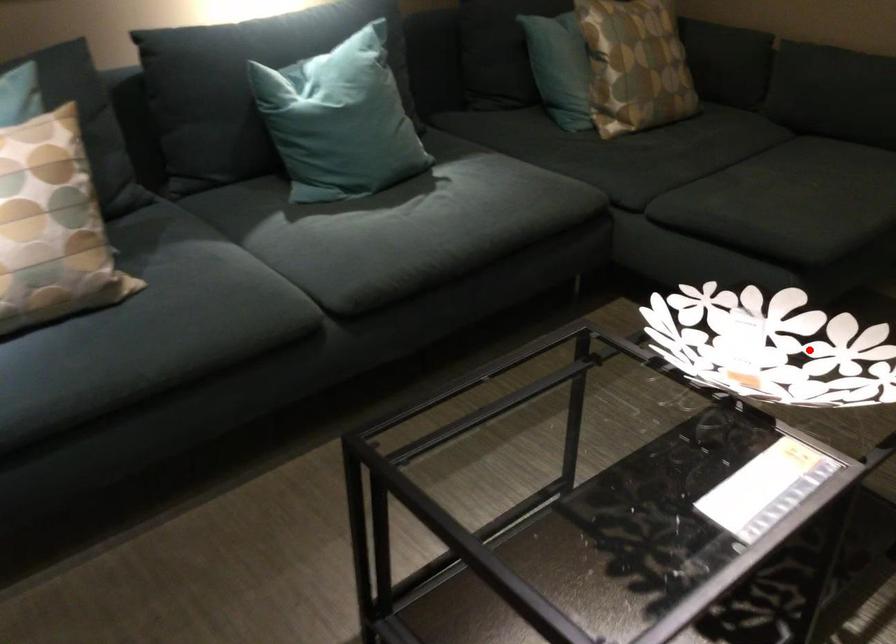
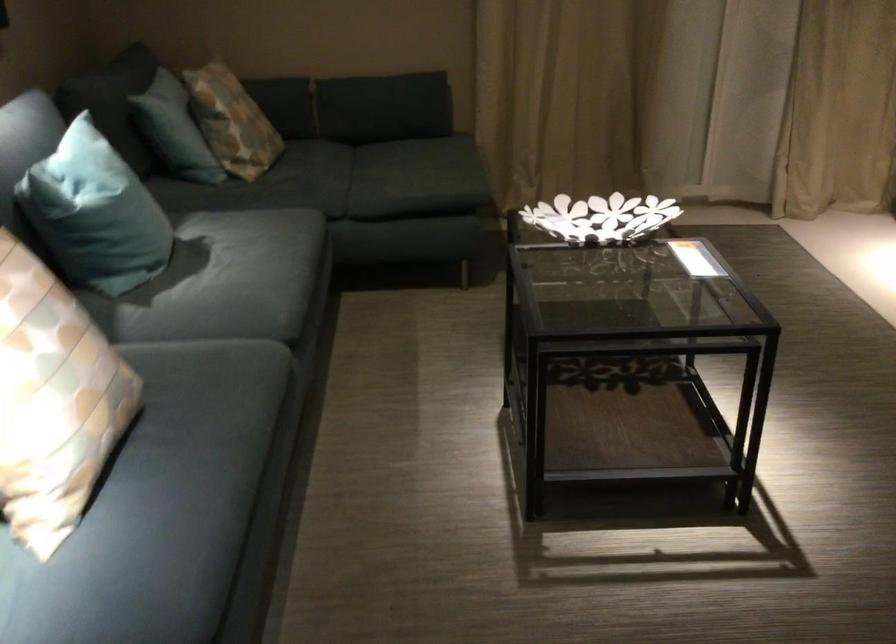
Question: A red point is marked in image1. In image2, is the corresponding 3D point closer to the camera or farther? Reply with the corresponding letter.

Choices:
 (A) The corresponding 3D point is closer.
 (B) The corresponding 3D point is farther.

Answer: (B)